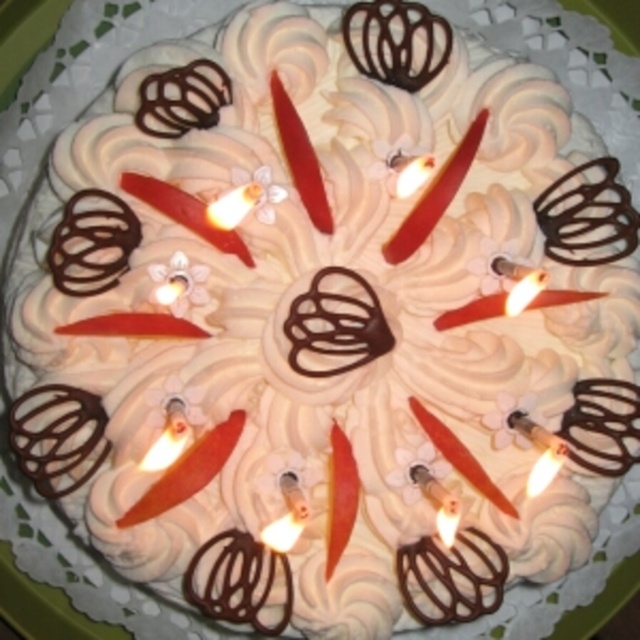
From the picture: You are at a birthday party and see a cake with two candles at its center. The candles are labeled as the matte red candle at center and the white wax candle at center. Which candle is taller?

The matte red candle at center is taller than the white wax candle at center according to the description.